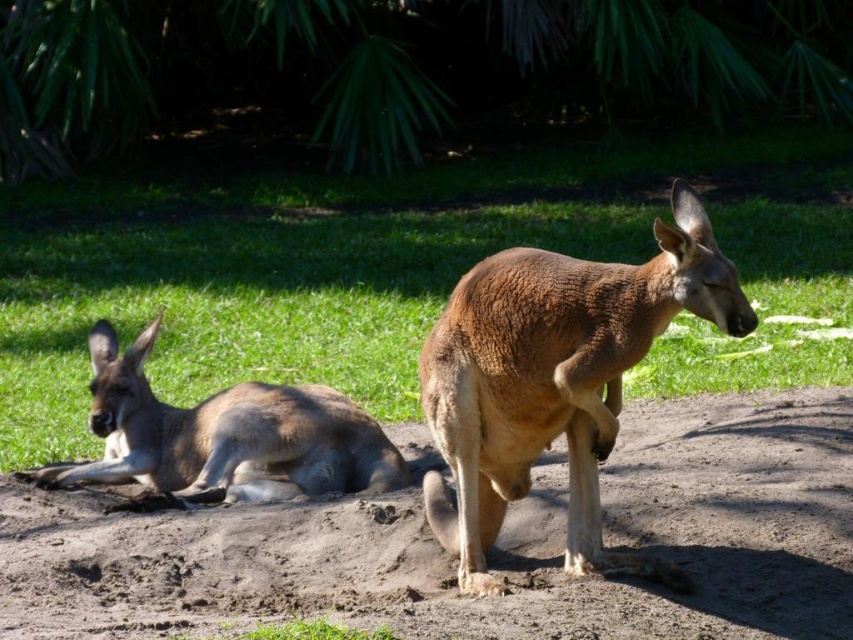
Question: Which point appears closest to the camera in this image?

Choices:
 (A) (265, 349)
 (B) (828, 477)
 (C) (299, 400)
 (D) (602, 289)

Answer: (D)

Question: Is brown sandy dirt at center thinner than brown fur kangaroo at lower left?

Choices:
 (A) no
 (B) yes

Answer: (A)

Question: Is brown sandy dirt at center to the left of brown fur kangaroo at center from the viewer's perspective?

Choices:
 (A) yes
 (B) no

Answer: (A)

Question: Estimate the real-world distances between objects in this image. Which object is closer to the brown fur kangaroo at lower left?

Choices:
 (A) green grass at center
 (B) brown sandy dirt at center

Answer: (B)

Question: Does green grass at center have a larger size compared to brown sandy dirt at center?

Choices:
 (A) yes
 (B) no

Answer: (A)

Question: Considering the real-world distances, which object is farthest from the green grass at center?

Choices:
 (A) brown fur kangaroo at center
 (B) brown sandy dirt at center

Answer: (A)